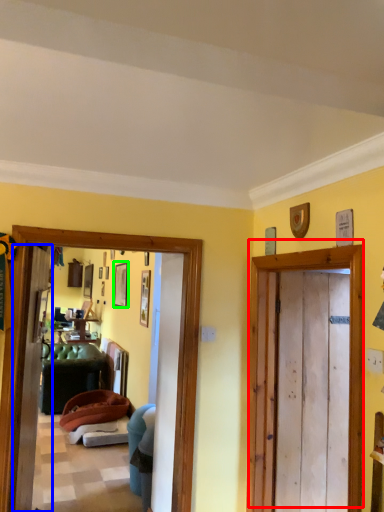
Question: Based on their relative distances, which object is nearer to door (highlighted by a red box)? Choose from screen door (highlighted by a blue box) and picture frame (highlighted by a green box).

Choices:
 (A) screen door
 (B) picture frame

Answer: (A)